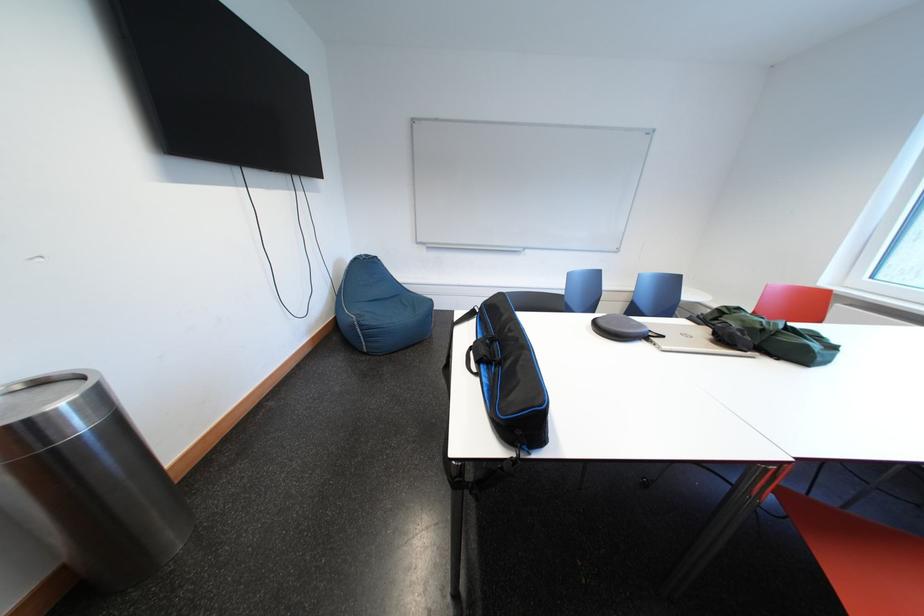
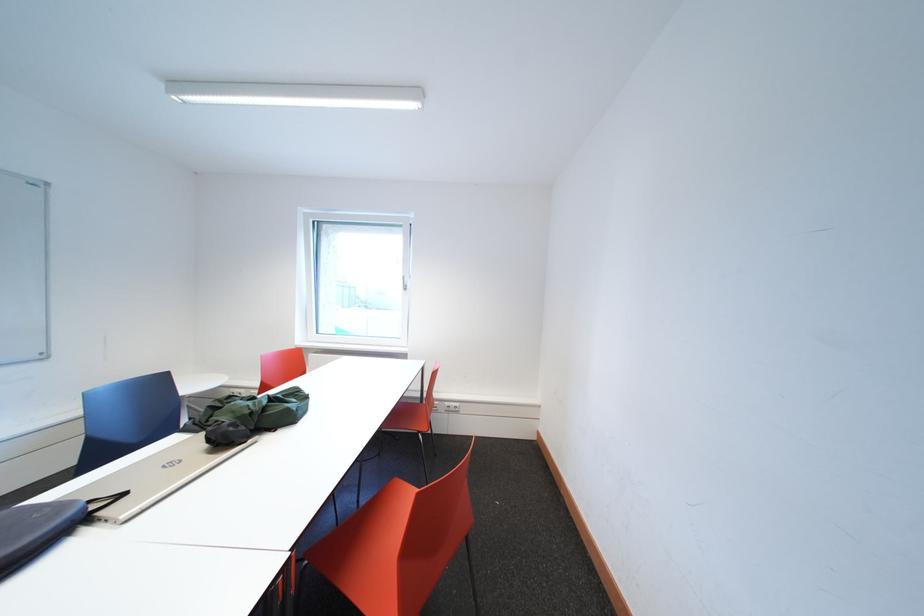
Where in the second image is the point corresponding to point 653,334 from the first image?

(79, 517)